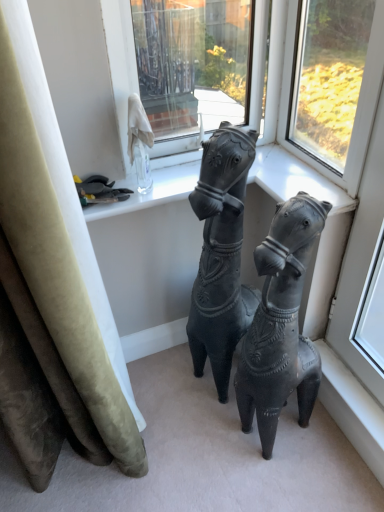
The width and height of the screenshot is (384, 512). Describe the element at coordinates (358, 104) in the screenshot. I see `transparent glass window at upper center, marked as the second window in a left-to-right arrangement` at that location.

At what (x,y) coordinates should I click in order to perform the action: click on transparent glass window at upper center, marked as the second window in a right-to-left arrangement. Please return your answer as a coordinate pair (x, y). This screenshot has width=384, height=512. Looking at the image, I should click on (192, 67).

Where is `matte black horse at center`? Image resolution: width=384 pixels, height=512 pixels. matte black horse at center is located at coordinates (281, 324).

Considering the relative sizes of transparent glass window at upper center, marked as the second window in a right-to-left arrangement, and transparent glass window at upper center, marked as the second window in a left-to-right arrangement, in the image provided, is transparent glass window at upper center, marked as the second window in a right-to-left arrangement, shorter than transparent glass window at upper center, marked as the second window in a left-to-right arrangement,?

No.

Choose the correct answer: Is transparent glass window at upper center, marked as the second window in a right-to-left arrangement, inside transparent glass window at upper center, marked as the second window in a left-to-right arrangement, or outside it?

transparent glass window at upper center, marked as the second window in a right-to-left arrangement, is not inside transparent glass window at upper center, marked as the second window in a left-to-right arrangement, it's outside.

How many degrees apart are the facing directions of transparent glass window at upper center, marked as the second window in a right-to-left arrangement, and transparent glass window at upper center, marked as the second window in a left-to-right arrangement?

They differ by 90 degrees in their facing directions.

Is transparent glass window at upper center, marked as the second window in a right-to-left arrangement, to the left of transparent glass window at upper center, the first window positioned from the right, from the viewer's perspective?

Yes, transparent glass window at upper center, marked as the second window in a right-to-left arrangement, is to the left of transparent glass window at upper center, the first window positioned from the right.

Which is correct: matte black horse at center is inside transparent glass window at upper center, the first window positioned from the right, or outside of it?

The correct answer is: outside.

Is matte black horse at center facing away from transparent glass window at upper center, marked as the second window in a left-to-right arrangement?

That's not correct — matte black horse at center is not looking away from transparent glass window at upper center, marked as the second window in a left-to-right arrangement.

Is point (263, 337) closer or farther from the camera than point (380, 6)?

Clearly, point (263, 337) is more distant from the camera than point (380, 6).

Is matte black horse at center positioned behind transparent glass window at upper center, marked as the second window in a left-to-right arrangement?

No, matte black horse at center is closer to the camera.

What's the angular difference between transparent glass window at upper center, marked as the second window in a left-to-right arrangement, and transparent glass window at upper center, which is the first window in left-to-right order,'s facing directions?

The angular difference between transparent glass window at upper center, marked as the second window in a left-to-right arrangement, and transparent glass window at upper center, which is the first window in left-to-right order, is 90 degrees.

This screenshot has height=512, width=384. Find the location of `window that appears below the transparent glass window at upper center, which is the first window in left-to-right order (from the image's perspective)`. window that appears below the transparent glass window at upper center, which is the first window in left-to-right order (from the image's perspective) is located at coordinates (358, 104).

Considering the positions of objects transparent glass window at upper center, the first window positioned from the right, and transparent glass window at upper center, which is the first window in left-to-right order, in the image provided, who is more to the right, transparent glass window at upper center, the first window positioned from the right, or transparent glass window at upper center, which is the first window in left-to-right order,?

transparent glass window at upper center, the first window positioned from the right, is more to the right.

Who is smaller, transparent glass window at upper center, the first window positioned from the right, or transparent glass window at upper center, marked as the second window in a right-to-left arrangement?

With smaller size is transparent glass window at upper center, the first window positioned from the right.

Can matte black horse at center be found inside transparent glass window at upper center, the first window positioned from the right?

No.

From a real-world perspective, which object rests below the other?

matte black horse at center.

Considering the relative positions of transparent glass window at upper center, the first window positioned from the right, and matte black horse at center in the image provided, is transparent glass window at upper center, the first window positioned from the right, in front of matte black horse at center?

No, transparent glass window at upper center, the first window positioned from the right, is behind matte black horse at center.

Considering the relative positions of transparent glass window at upper center, marked as the second window in a left-to-right arrangement, and matte black horse at center in the image provided, is transparent glass window at upper center, marked as the second window in a left-to-right arrangement, to the left or to the right of matte black horse at center?

transparent glass window at upper center, marked as the second window in a left-to-right arrangement, is to the right of matte black horse at center.

Is matte black horse at center outside of transparent glass window at upper center, marked as the second window in a right-to-left arrangement?

Yes, matte black horse at center is not within transparent glass window at upper center, marked as the second window in a right-to-left arrangement.

From a real-world perspective, is matte black horse at center under transparent glass window at upper center, marked as the second window in a right-to-left arrangement?

Correct, in the physical world, matte black horse at center is lower than transparent glass window at upper center, marked as the second window in a right-to-left arrangement.

Is matte black horse at center bigger than transparent glass window at upper center, marked as the second window in a right-to-left arrangement?

Yes, matte black horse at center is bigger than transparent glass window at upper center, marked as the second window in a right-to-left arrangement.

Between matte black horse at center and transparent glass window at upper center, marked as the second window in a right-to-left arrangement, which one appears on the left side from the viewer's perspective?

From the viewer's perspective, transparent glass window at upper center, marked as the second window in a right-to-left arrangement, appears more on the left side.

Would you say transparent glass window at upper center, which is the first window in left-to-right order, is inside or outside matte black horse at center?

transparent glass window at upper center, which is the first window in left-to-right order, is spatially situated outside matte black horse at center.

Considering the relative sizes of transparent glass window at upper center, marked as the second window in a right-to-left arrangement, and matte black horse at center in the image provided, is transparent glass window at upper center, marked as the second window in a right-to-left arrangement, smaller than matte black horse at center?

Yes.

From the image's perspective, which one is positioned higher, transparent glass window at upper center, which is the first window in left-to-right order, or matte black horse at center?

transparent glass window at upper center, which is the first window in left-to-right order.

Which is behind, point (178, 26) or point (246, 418)?

Positioned behind is point (178, 26).

This screenshot has width=384, height=512. Find the location of `window below the transparent glass window at upper center, which is the first window in left-to-right order (from a real-world perspective)`. window below the transparent glass window at upper center, which is the first window in left-to-right order (from a real-world perspective) is located at coordinates (358, 104).

Where is `horse in front of the transparent glass window at upper center, marked as the second window in a left-to-right arrangement`? horse in front of the transparent glass window at upper center, marked as the second window in a left-to-right arrangement is located at coordinates (x=281, y=324).

From the image, which object appears to be farther from transparent glass window at upper center, marked as the second window in a right-to-left arrangement, matte black horse at center or transparent glass window at upper center, the first window positioned from the right?

matte black horse at center.

From the image, which object appears to be farther from matte black horse at center, transparent glass window at upper center, the first window positioned from the right, or transparent glass window at upper center, which is the first window in left-to-right order?

Based on the image, transparent glass window at upper center, which is the first window in left-to-right order, appears to be further to matte black horse at center.

Estimate the real-world distances between objects in this image. Which object is closer to transparent glass window at upper center, marked as the second window in a right-to-left arrangement, transparent glass window at upper center, marked as the second window in a left-to-right arrangement, or matte black horse at center?

Based on the image, transparent glass window at upper center, marked as the second window in a left-to-right arrangement, appears to be nearer to transparent glass window at upper center, marked as the second window in a right-to-left arrangement.

From the image, which object appears to be nearer to matte black horse at center, transparent glass window at upper center, which is the first window in left-to-right order, or transparent glass window at upper center, marked as the second window in a left-to-right arrangement?

transparent glass window at upper center, marked as the second window in a left-to-right arrangement.

Based on their spatial positions, is matte black horse at center or transparent glass window at upper center, marked as the second window in a right-to-left arrangement, further from transparent glass window at upper center, marked as the second window in a left-to-right arrangement?

transparent glass window at upper center, marked as the second window in a right-to-left arrangement, is positioned further to the anchor transparent glass window at upper center, marked as the second window in a left-to-right arrangement.

From the image, which object appears to be nearer to transparent glass window at upper center, the first window positioned from the right, transparent glass window at upper center, marked as the second window in a right-to-left arrangement, or matte black horse at center?

matte black horse at center is closer to transparent glass window at upper center, the first window positioned from the right.

Image resolution: width=384 pixels, height=512 pixels. Identify the location of window between transparent glass window at upper center, marked as the second window in a right-to-left arrangement, and matte black horse at center in the up-down direction. (358, 104).